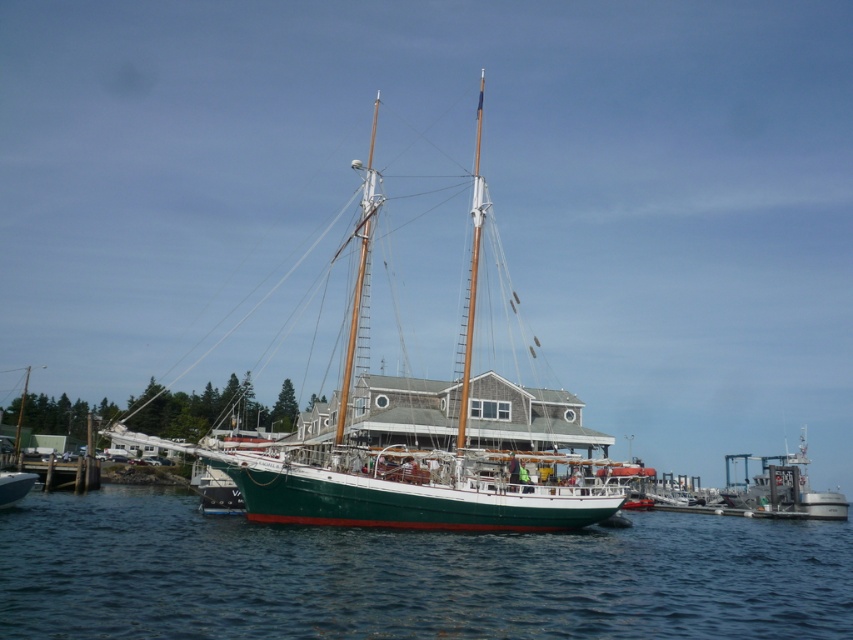
You are a photographer planning to capture the green matte sailboat at center and the metallic gray boat at right in a single frame. Based on their heights, which boat should you position closer to the camera to ensure both appear equally tall in the photo?

The green matte sailboat at center is taller than the metallic gray boat at right. To make them appear equally tall in the photo, position the metallic gray boat at right closer to the camera since it is shorter and needs to be nearer to match the height of the green matte sailboat at center in the frame.

You are a harbor worker who needs to move the green matte sailboat at center and the metallic gray boat at right. Based on their current positions, which boat is blocking the other from leaving the harbor?

The green matte sailboat at center is positioned over the metallic gray boat at right, so it is blocking the metallic gray boat at right from leaving the harbor.

Based on the coordinates provided in the scene, where is the green matte water at center located?

The green matte water at center is located at point (408, 577).